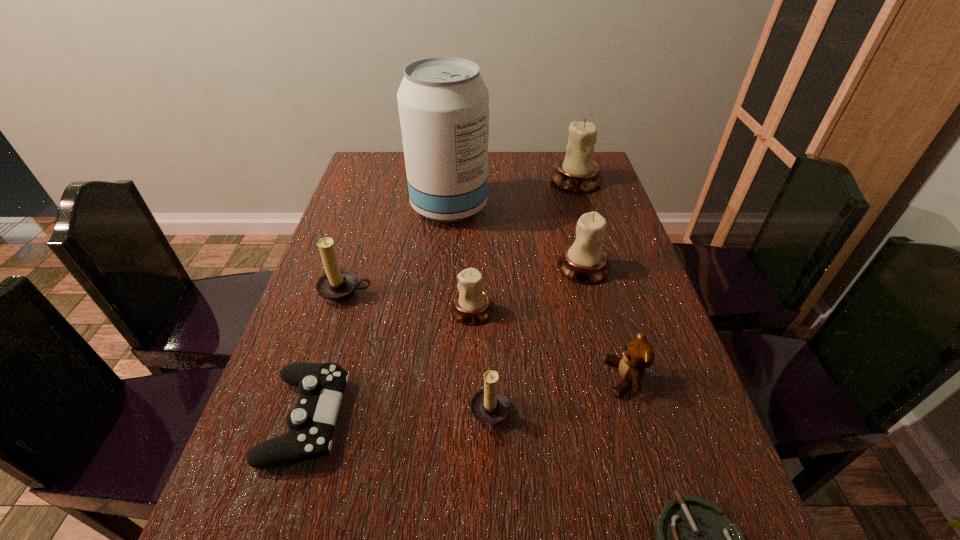
The image size is (960, 540). Identify the location of the tallest object. (443, 102).

The image size is (960, 540). Identify the location of the farthest white candle holder. (577, 172).

Identify the location of the tallest candle holder. (577, 172).

Find the location of a particular element. The height and width of the screenshot is (540, 960). the second farthest white candle holder is located at coordinates (585, 261).

Image resolution: width=960 pixels, height=540 pixels. What are the coordinates of `the bigger brown candle holder` in the screenshot? It's located at (337, 285).

The width and height of the screenshot is (960, 540). What are the coordinates of `the left brown candle holder` in the screenshot? It's located at (337, 285).

This screenshot has height=540, width=960. I want to click on the leftmost white candle holder, so click(x=471, y=306).

Identify the location of the smallest white candle holder. (471, 306).

The image size is (960, 540). Find the location of `the nearest candle holder`. the nearest candle holder is located at coordinates (490, 406).

You are a GUI agent. You are given a task and a screenshot of the screen. Output one action in this format:
    pyautogui.click(x=<x>, y=<y>)
    Task: Click on the right brown candle holder
    The width and height of the screenshot is (960, 540).
    Given the screenshot: What is the action you would take?
    490,406